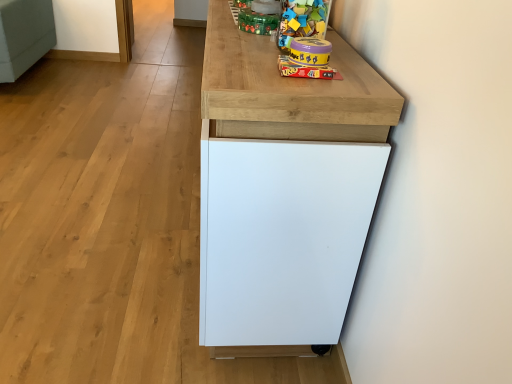
Question: From a real-world perspective, is matte yellow plastic uno game at upper center, which appears as the 2th toy when viewed from the back, physically above matte green plastic toy at upper center, positioned as the 3th toy in front-to-back order?

Choices:
 (A) no
 (B) yes

Answer: (A)

Question: Can you confirm if matte yellow plastic uno game at upper center, the third toy in the top-to-bottom sequence, is shorter than matte green plastic toy at upper center, the 3th toy when ordered from bottom to top?

Choices:
 (A) no
 (B) yes

Answer: (B)

Question: Is matte yellow plastic uno game at upper center, the third toy in the top-to-bottom sequence, oriented away from matte green plastic toy at upper center, positioned as the 3th toy in front-to-back order?

Choices:
 (A) yes
 (B) no

Answer: (B)

Question: Considering the relative sizes of matte yellow plastic uno game at upper center, the third toy in the top-to-bottom sequence, and matte green plastic toy at upper center, positioned as the 3th toy in front-to-back order, in the image provided, is matte yellow plastic uno game at upper center, the third toy in the top-to-bottom sequence, taller than matte green plastic toy at upper center, positioned as the 3th toy in front-to-back order,?

Choices:
 (A) yes
 (B) no

Answer: (B)

Question: Is matte yellow plastic uno game at upper center, the third toy in the top-to-bottom sequence, at the left side of matte green plastic toy at upper center, positioned as the 3th toy in front-to-back order?

Choices:
 (A) no
 (B) yes

Answer: (A)

Question: Would you say matte green plastic toy at upper center, the 1th toy when ordered from top to bottom, is to the left or to the right of white matte cabinet at center in the picture?

Choices:
 (A) right
 (B) left

Answer: (A)

Question: Does point (246, 29) appear closer or farther from the camera than point (249, 345)?

Choices:
 (A) farther
 (B) closer

Answer: (B)

Question: From a real-world perspective, is matte green plastic toy at upper center, the 1th toy when ordered from top to bottom, physically located above or below white matte cabinet at center?

Choices:
 (A) below
 (B) above

Answer: (B)

Question: Considering the positions of matte green plastic toy at upper center, arranged as the 1th toy when viewed from the back, and white matte cabinet at center in the image, is matte green plastic toy at upper center, arranged as the 1th toy when viewed from the back, taller or shorter than white matte cabinet at center?

Choices:
 (A) tall
 (B) short

Answer: (B)

Question: From the image's perspective, relative to white matte cabinet at center, is purple plastic container at upper center, which is the 3th toy in back-to-front order, above or below?

Choices:
 (A) below
 (B) above

Answer: (B)

Question: Is purple plastic container at upper center, which is the second toy in top-to-bottom order, wider or thinner than white matte cabinet at center?

Choices:
 (A) wide
 (B) thin

Answer: (B)

Question: Relative to white matte cabinet at center, is purple plastic container at upper center, which is the 3th toy in back-to-front order, in front or behind?

Choices:
 (A) front
 (B) behind

Answer: (B)

Question: In terms of size, does purple plastic container at upper center, which is the 2th toy from bottom to top, appear bigger or smaller than white matte cabinet at center?

Choices:
 (A) small
 (B) big

Answer: (A)

Question: Considering the positions of white matte cabinet at center and matte green plastic toy at upper center, arranged as the 1th toy when viewed from the back, in the image, is white matte cabinet at center bigger or smaller than matte green plastic toy at upper center, arranged as the 1th toy when viewed from the back,?

Choices:
 (A) big
 (B) small

Answer: (A)

Question: From a real-world perspective, is white matte cabinet at center positioned above or below matte green plastic toy at upper center, positioned as the 3th toy in front-to-back order?

Choices:
 (A) below
 (B) above

Answer: (A)